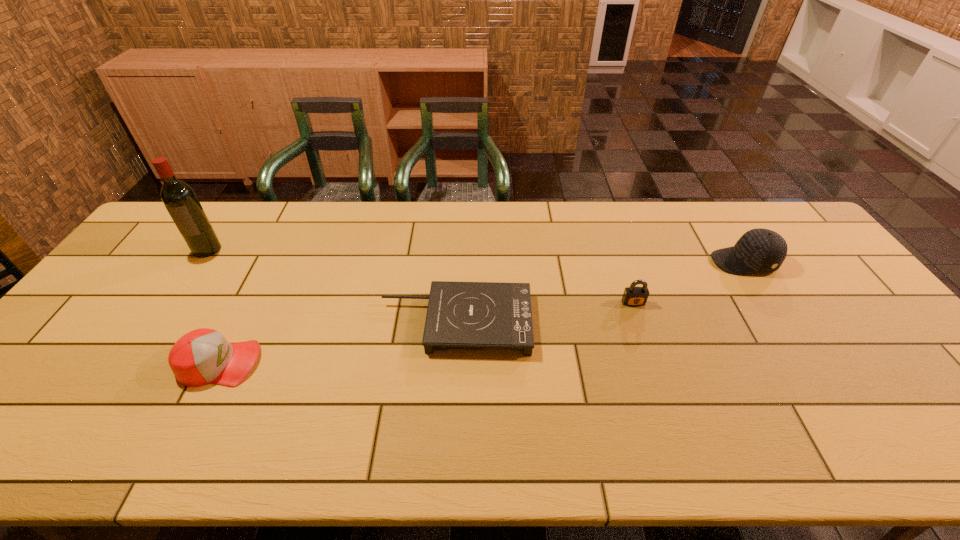
Find the location of a particular element. The image size is (960, 540). vacant space at the far right corner of the desktop is located at coordinates (779, 207).

At what (x,y) coordinates should I click in order to perform the action: click on vacant area that lies between the tallest object and the padlock. Please return your answer as a coordinate pair (x, y). The width and height of the screenshot is (960, 540). Looking at the image, I should click on (420, 276).

You are a GUI agent. You are given a task and a screenshot of the screen. Output one action in this format:
    pyautogui.click(x=<x>, y=<y>)
    Task: Click on the empty space between the shortest object and the wine bottle
    
    Given the screenshot: What is the action you would take?
    pyautogui.click(x=331, y=286)

The height and width of the screenshot is (540, 960). I want to click on unoccupied area between the wine bottle and the fourth object from left to right, so click(x=420, y=276).

I want to click on vacant area between the leftmost object and the shorter baseball cap, so click(213, 306).

Locate an element on the screen. This screenshot has height=540, width=960. free space between the rightmost object and the tallest object is located at coordinates (475, 255).

Where is `free space between the nearer baseball cap and the leftmost object`? The image size is (960, 540). free space between the nearer baseball cap and the leftmost object is located at coordinates (213, 306).

Locate an element on the screen. The width and height of the screenshot is (960, 540). free point between the hotplate and the wine bottle is located at coordinates (331, 286).

What are the coordinates of `vacant point located between the fourth object from left to right and the tallest object` in the screenshot? It's located at pyautogui.click(x=420, y=276).

Identify the location of free space between the fourth object from left to right and the hotplate. The width and height of the screenshot is (960, 540). (544, 313).